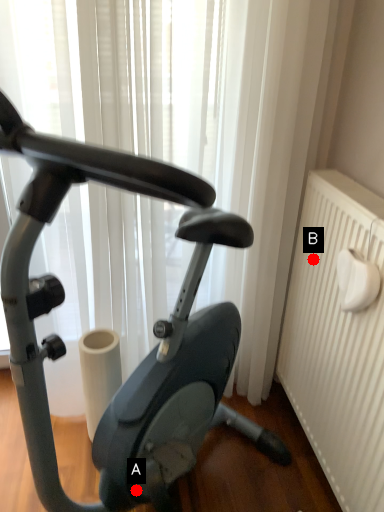
Question: Two points are circled on the image, labeled by A and B beside each circle. Which point is further to the camera?

Choices:
 (A) A is further
 (B) B is further

Answer: (B)